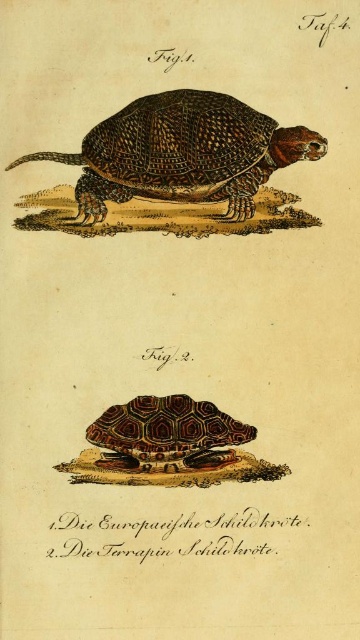
Question: Can you confirm if brown textured shell at center is positioned below leopard-patterned shell at center?

Choices:
 (A) yes
 (B) no

Answer: (B)

Question: Does brown textured shell at center have a larger size compared to leopard-patterned shell at center?

Choices:
 (A) no
 (B) yes

Answer: (B)

Question: Which of the following is the closest to the observer?

Choices:
 (A) brown textured shell at center
 (B) leopard-patterned shell at center

Answer: (B)

Question: Which of the following is the closest to the observer?

Choices:
 (A) leopard-patterned shell at center
 (B) brown textured shell at center

Answer: (A)

Question: Is brown textured shell at center above leopard-patterned shell at center?

Choices:
 (A) no
 (B) yes

Answer: (B)